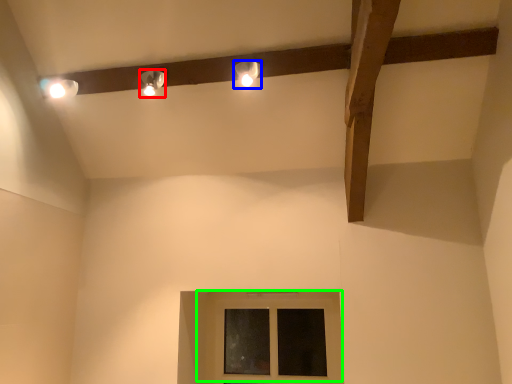
Question: Which is farther away from lamp (highlighted by a red box)? lamp (highlighted by a blue box) or window (highlighted by a green box)?

Choices:
 (A) lamp
 (B) window

Answer: (B)